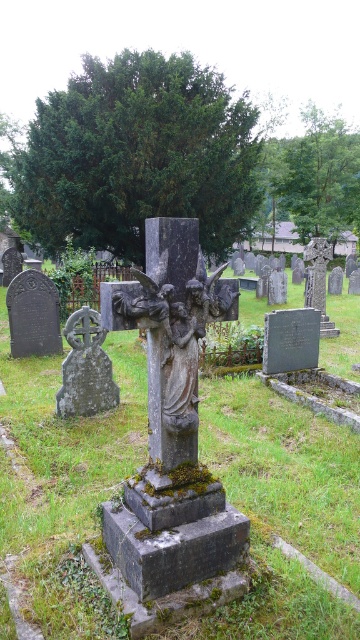
Which is more to the right, gray stone statue at center or gray stone cross at lower left?

Positioned to the right is gray stone statue at center.

Identify the location of gray stone statue at center. (171, 365).

You are a GUI agent. You are given a task and a screenshot of the screen. Output one action in this format:
    pyautogui.click(x=<x>, y=<y>)
    Task: Click on the gray stone statue at center
    The width and height of the screenshot is (360, 640).
    Given the screenshot: What is the action you would take?
    pyautogui.click(x=171, y=365)